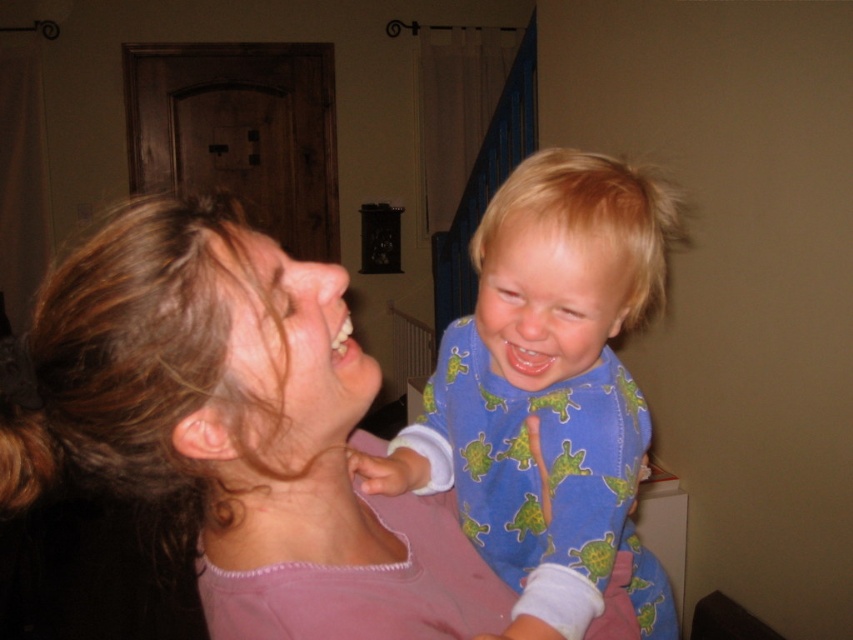
Question: Which point is farther to the camera?

Choices:
 (A) (366, 556)
 (B) (579, 451)

Answer: (B)

Question: Is pink fabric shirt at upper left bigger than blue soft pajamas at center?

Choices:
 (A) no
 (B) yes

Answer: (B)

Question: Does pink fabric shirt at upper left have a smaller size compared to blue soft pajamas at center?

Choices:
 (A) no
 (B) yes

Answer: (A)

Question: Can you confirm if pink fabric shirt at upper left is bigger than blue soft pajamas at center?

Choices:
 (A) yes
 (B) no

Answer: (A)